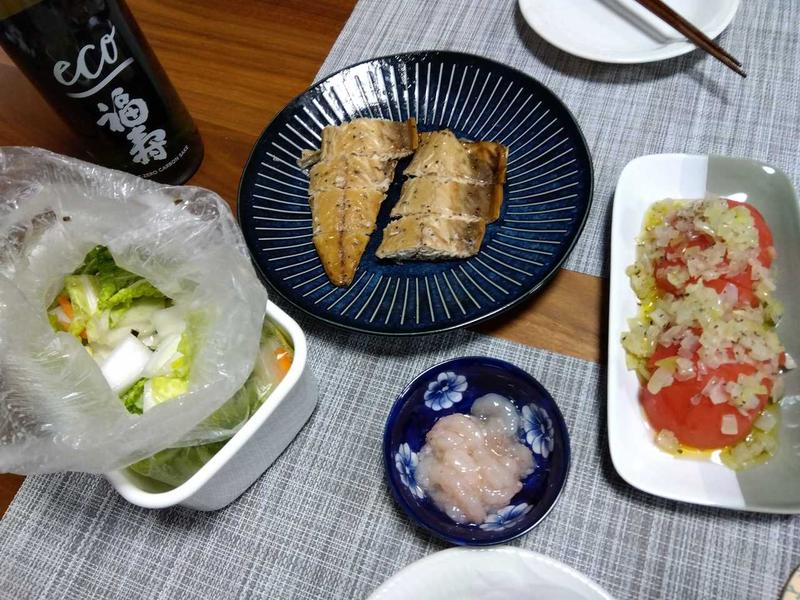
Image resolution: width=800 pixels, height=600 pixels. Identify the location of placemats. tap(694, 120), tap(352, 506).